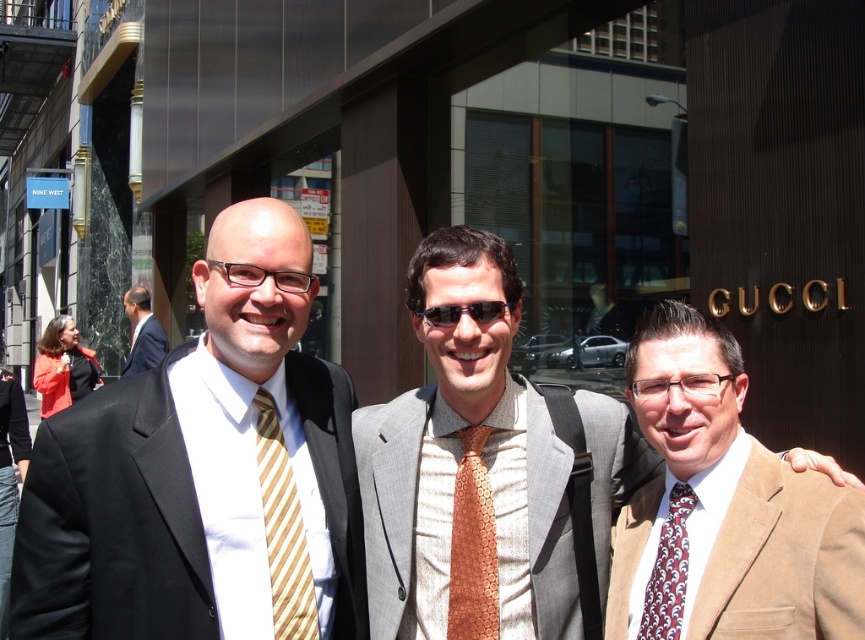
Question: Which point is closer to the camera?

Choices:
 (A) (361, 486)
 (B) (155, 472)

Answer: (B)

Question: Which object is closer to the camera taking this photo?

Choices:
 (A) brown suede suit at center
 (B) orange textured tie at center

Answer: (A)

Question: Which point appears farthest from the camera in this image?

Choices:
 (A) (11, 458)
 (B) (292, 637)

Answer: (A)

Question: Where is matte gray suit at center located in relation to light gray textured suit at center in the image?

Choices:
 (A) above
 (B) below

Answer: (A)

Question: Is orange textured tie at center thinner than black suit at left?

Choices:
 (A) no
 (B) yes

Answer: (B)

Question: Does light gray textured suit at center appear on the right side of dark blue suit at left?

Choices:
 (A) yes
 (B) no

Answer: (A)